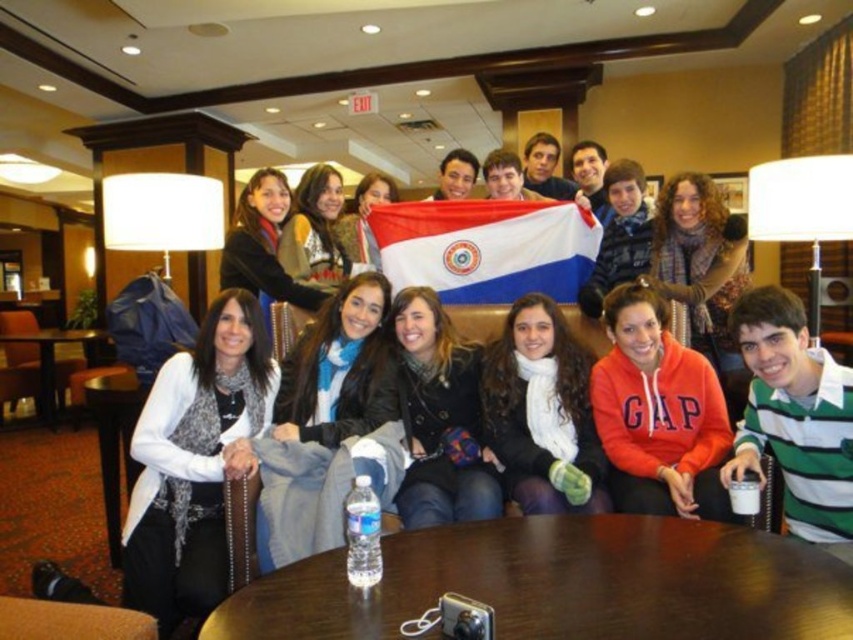
Can you confirm if brown wooden table at center is thinner than brown wooden table at lower left?

Incorrect, brown wooden table at center's width is not less than brown wooden table at lower left's.

Does brown wooden table at center have a greater width compared to brown wooden table at lower left?

Correct, the width of brown wooden table at center exceeds that of brown wooden table at lower left.

Does point (212, 616) come farther from viewer compared to point (86, 339)?

No, (212, 616) is closer to viewer.

Find the location of `brown wooden table at center`. brown wooden table at center is located at coordinates (561, 582).

Is point (589, 220) less distant than point (102, 438)?

No, it is behind (102, 438).

Does white fabric flag at center have a smaller size compared to wooden table at lower left?

Yes.

Which is in front, point (498, 285) or point (103, 401)?

Point (103, 401)

The image size is (853, 640). What are the coordinates of `white fabric flag at center` in the screenshot? It's located at (486, 248).

Based on the photo, does brown wooden table at center have a greater height compared to wooden table at lower left?

No, brown wooden table at center is not taller than wooden table at lower left.

Based on the photo, who is more distant from viewer, (543, 592) or (109, 417)?

The point (109, 417) is more distant.

This screenshot has height=640, width=853. I want to click on brown wooden table at center, so click(561, 582).